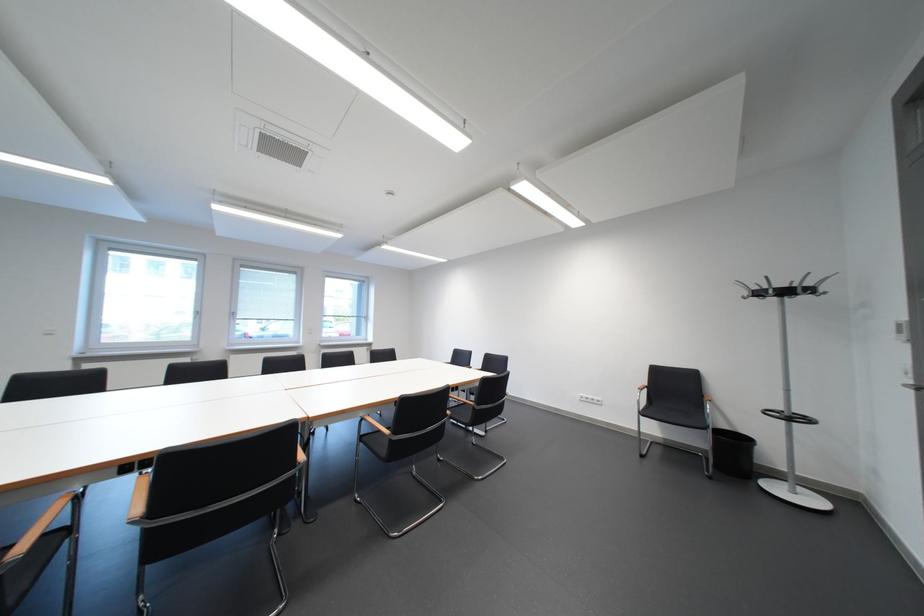
Which object does [733,453] point to?

It corresponds to the black trash can in the image.